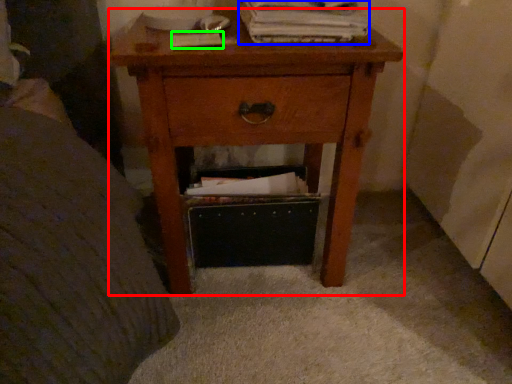
Question: Considering the real-world distances, which object is closest to nightstand (highlighted by a red box)? paperback book (highlighted by a blue box) or paperback book (highlighted by a green box).

Choices:
 (A) paperback book
 (B) paperback book

Answer: (A)